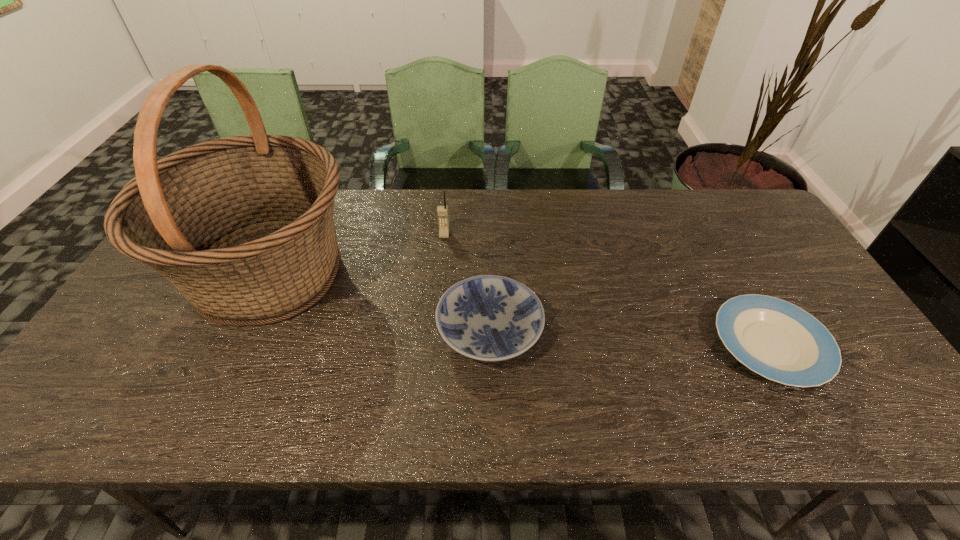
Find the location of a particular element. basket is located at coordinates (242, 226).

This screenshot has width=960, height=540. Find the location of `the leftmost object`. the leftmost object is located at coordinates (242, 226).

You are a GUI agent. You are given a task and a screenshot of the screen. Output one action in this format:
    pyautogui.click(x=<x>, y=<y>)
    Task: Click on the cellular telephone
    The image size is (960, 540).
    Given the screenshot: What is the action you would take?
    pyautogui.click(x=442, y=211)

This screenshot has height=540, width=960. I want to click on the left plate, so click(490, 318).

The image size is (960, 540). What are the coordinates of `the taller plate` in the screenshot? It's located at (490, 318).

The height and width of the screenshot is (540, 960). In order to click on the shorter plate in this screenshot , I will do `click(778, 340)`.

I want to click on the shortest object, so click(x=778, y=340).

Where is `free spot located on the right of the basket`? This screenshot has height=540, width=960. free spot located on the right of the basket is located at coordinates (394, 273).

Image resolution: width=960 pixels, height=540 pixels. I want to click on vacant area situated on the front of the cellular telephone, where the keypad is located, so click(x=442, y=264).

The image size is (960, 540). I want to click on vacant space located on the front of the third tallest object, so click(491, 404).